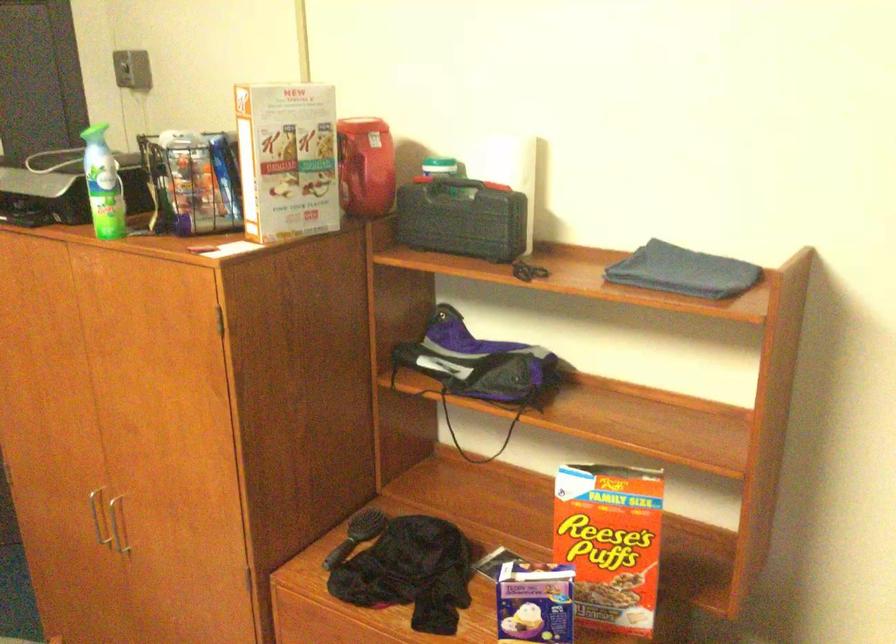
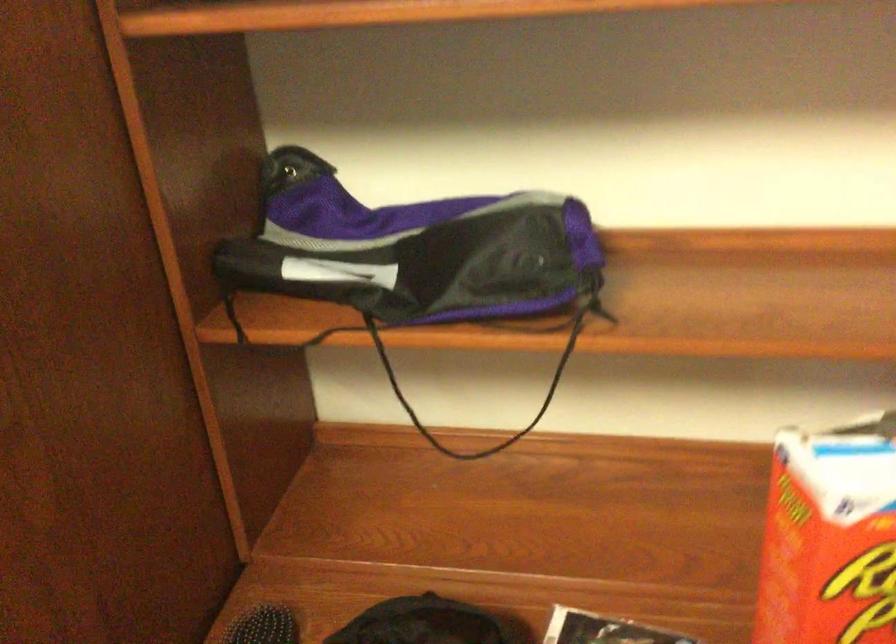
Locate, in the second image, the point that corresponds to point (371, 516) in the first image.

(263, 626)